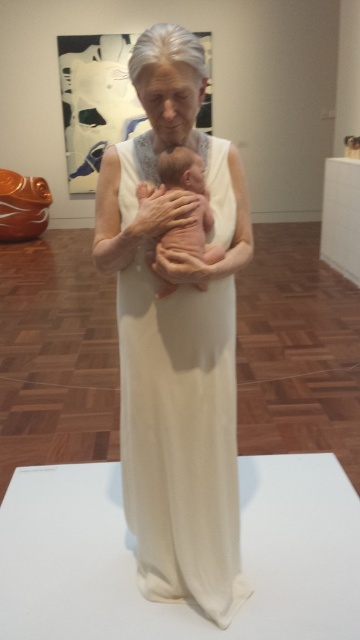
Can you confirm if white matte dress at center is smaller than pink matte baby at center?

Incorrect, white matte dress at center is not smaller in size than pink matte baby at center.

Is white matte dress at center to the right of pink matte baby at center from the viewer's perspective?

Correct, you'll find white matte dress at center to the right of pink matte baby at center.

Which is in front, point (213, 432) or point (194, 224)?

Positioned in front is point (194, 224).

This screenshot has height=640, width=360. I want to click on white matte dress at center, so click(x=181, y=440).